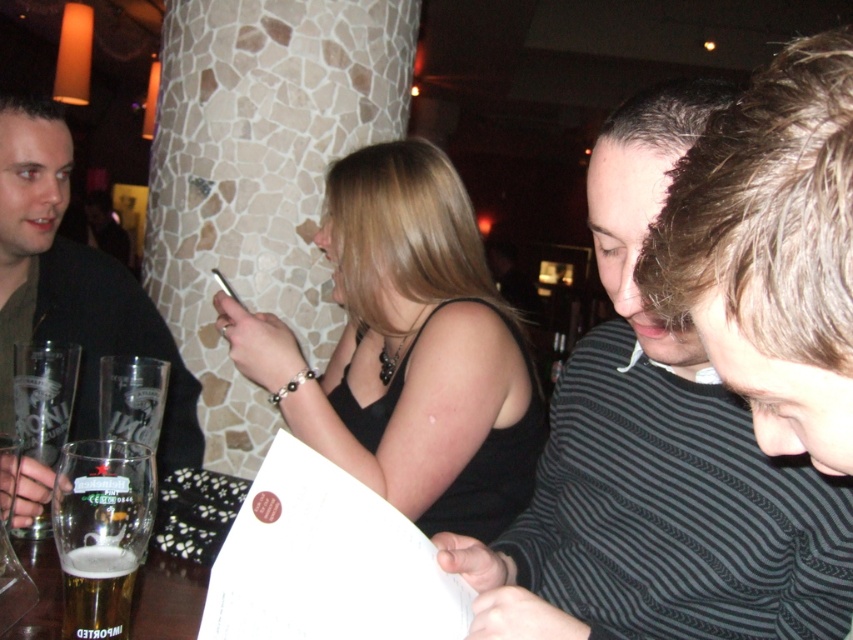
Question: Does dark brown leather jacket at left have a larger size compared to amber glass beer at lower left?

Choices:
 (A) yes
 (B) no

Answer: (A)

Question: Among these points, which one is nearest to the camera?

Choices:
 (A) (126, 588)
 (B) (90, 378)

Answer: (A)

Question: Can you confirm if striped sweater at center is wider than dark brown leather jacket at left?

Choices:
 (A) yes
 (B) no

Answer: (A)

Question: Is striped sweater at center smaller than black matte tank top at center?

Choices:
 (A) yes
 (B) no

Answer: (A)

Question: Which of the following is the farthest from the observer?

Choices:
 (A) (373, 218)
 (B) (119, 564)

Answer: (A)

Question: Estimate the real-world distances between objects in this image. Which object is closer to the striped sweater at center?

Choices:
 (A) amber glass beer at lower left
 (B) black matte tank top at center

Answer: (B)